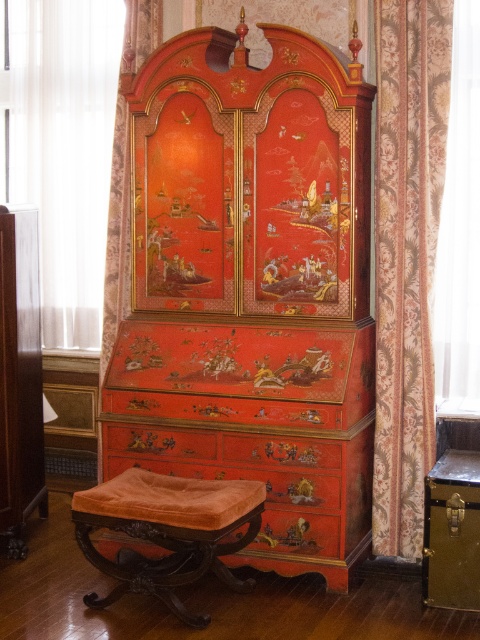
Question: Among these objects, which one is farthest from the camera?

Choices:
 (A) matte lacquered cabinet at left
 (B) velvet orange stool at lower center
 (C) cherry lacquer cabinet at center
 (D) metallic gold chest at lower right

Answer: (A)

Question: Which of these objects is positioned closest to the cherry lacquer cabinet at center?

Choices:
 (A) metallic gold chest at lower right
 (B) floral fabric curtain at right
 (C) matte lacquered cabinet at left
 (D) velvet orange stool at lower center

Answer: (B)

Question: Which of these objects is positioned farthest from the matte lacquered cabinet at left?

Choices:
 (A) metallic gold chest at lower right
 (B) velvet orange stool at lower center

Answer: (A)

Question: Does cherry lacquer cabinet at center have a smaller size compared to matte lacquered cabinet at left?

Choices:
 (A) no
 (B) yes

Answer: (A)

Question: Does velvet orange stool at lower center have a smaller size compared to metallic gold chest at lower right?

Choices:
 (A) yes
 (B) no

Answer: (B)

Question: Does floral fabric curtain at right have a greater width compared to matte lacquered cabinet at left?

Choices:
 (A) no
 (B) yes

Answer: (B)